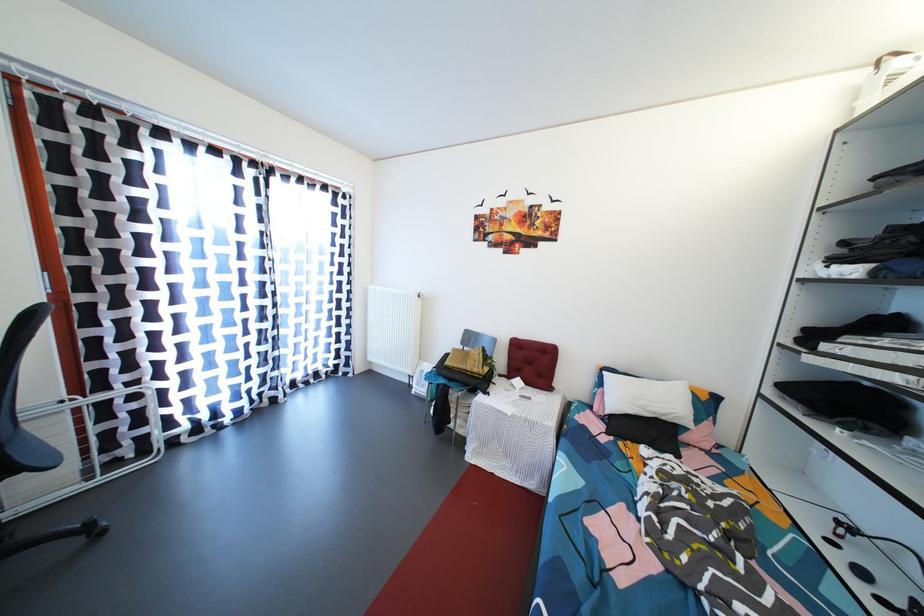
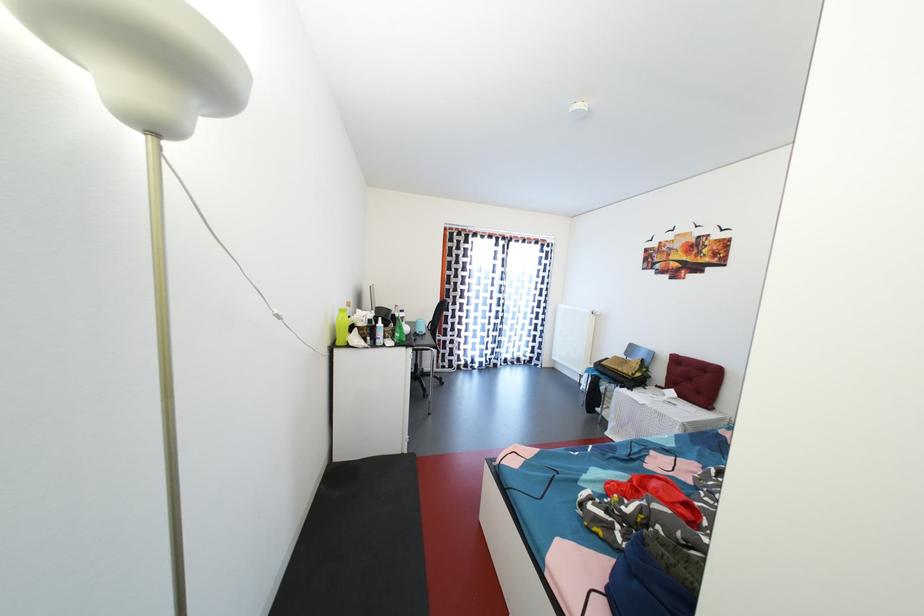
The point at (528,342) is marked in the first image. Where is the corresponding point in the second image?

(688, 359)